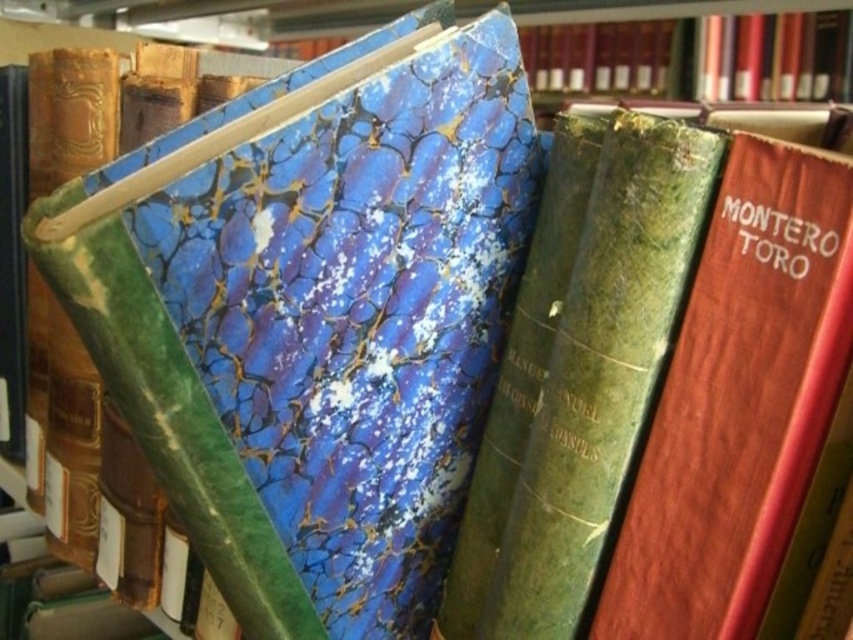
Based on the photo, does wooden book at center have a larger size compared to green marbled book at center?

No, wooden book at center is not bigger than green marbled book at center.

Between point (781, 428) and point (489, 620), which one is positioned in front?

Point (781, 428)

What are the coordinates of `wooden book at center` in the screenshot? It's located at (746, 412).